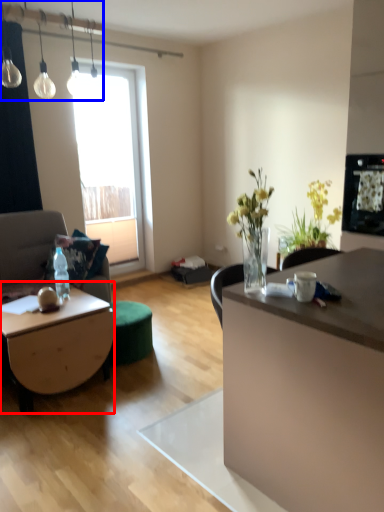
Question: Which object appears farthest to the camera in this image, coffee table (highlighted by a red box) or lamp (highlighted by a blue box)?

Choices:
 (A) coffee table
 (B) lamp

Answer: (A)